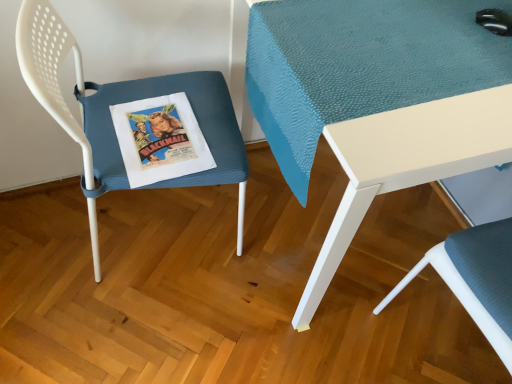
Question: Is teal fabric table at center bigger or smaller than textured blue cushion at lower right, placed as the second chair when sorted from left to right?

Choices:
 (A) small
 (B) big

Answer: (B)

Question: Is teal fabric table at center taller or shorter than textured blue cushion at lower right, placed as the second chair when sorted from left to right?

Choices:
 (A) tall
 (B) short

Answer: (B)

Question: Which object is the farthest from the teal fabric table at center?

Choices:
 (A) blue textured cushion at left, which appears as the 2th chair when viewed from the right
 (B) textured blue cushion at lower right, the first chair positioned from the right

Answer: (B)

Question: Which object is positioned closest to the textured blue cushion at lower right, the first chair positioned from the right?

Choices:
 (A) blue textured cushion at left, which is the 1th chair from left to right
 (B) teal fabric table at center

Answer: (B)